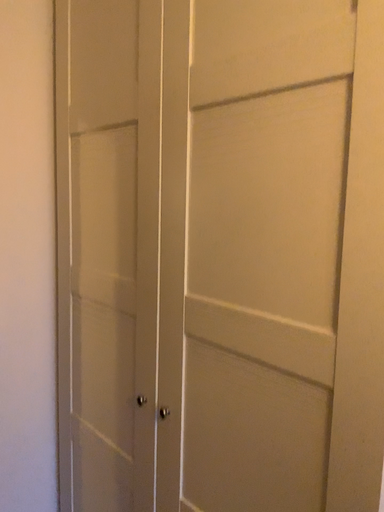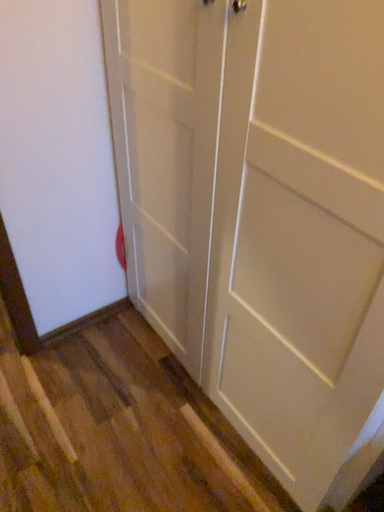
Question: How did the camera likely rotate when shooting the video?

Choices:
 (A) rotated left
 (B) rotated right

Answer: (A)